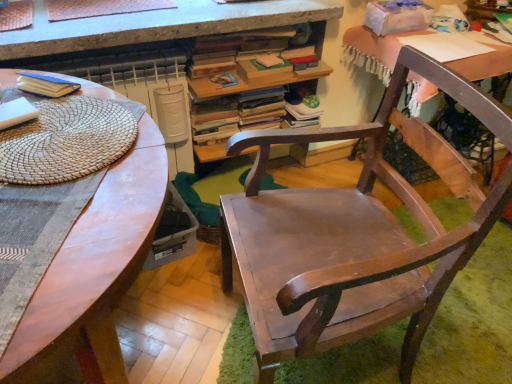
This screenshot has height=384, width=512. What are the coordinates of `vacant space in front of woven beige placemat at left` in the screenshot? It's located at (66, 228).